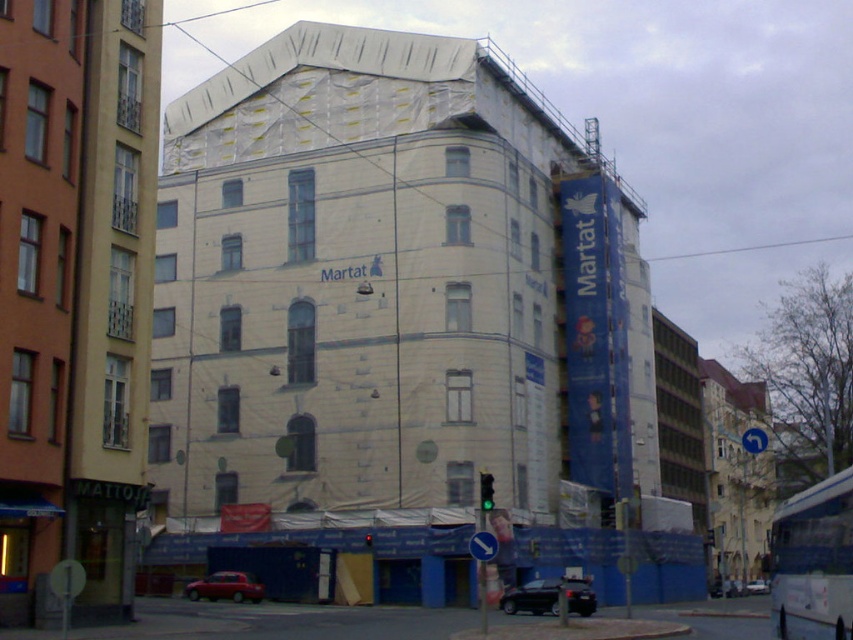
This screenshot has height=640, width=853. Describe the element at coordinates (532, 596) in the screenshot. I see `black glossy car at center` at that location.

Find the location of `black glossy car at center`. black glossy car at center is located at coordinates (532, 596).

Find the location of `black glossy car at center`. black glossy car at center is located at coordinates (532, 596).

Which of these two, shiny red car at lower left or silver metallic sedan at center, stands taller?

silver metallic sedan at center is taller.

You are a GUI agent. You are given a task and a screenshot of the screen. Output one action in this format:
    pyautogui.click(x=<x>, y=<y>)
    Task: Click on the shiny red car at lower left
    
    Given the screenshot: What is the action you would take?
    pyautogui.click(x=225, y=588)

Locate an element on the screen. shiny red car at lower left is located at coordinates (225, 588).

Is black glossy car at center above shiny red car at lower left?

Correct, black glossy car at center is located above shiny red car at lower left.

Does black glossy car at center come behind shiny red car at lower left?

No, black glossy car at center is closer to the viewer.

Find the location of a particular element. Image resolution: width=853 pixels, height=640 pixels. black glossy car at center is located at coordinates (532, 596).